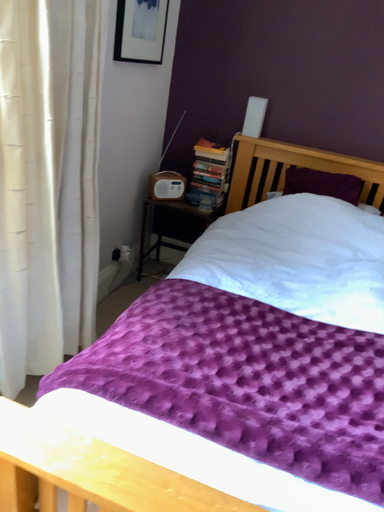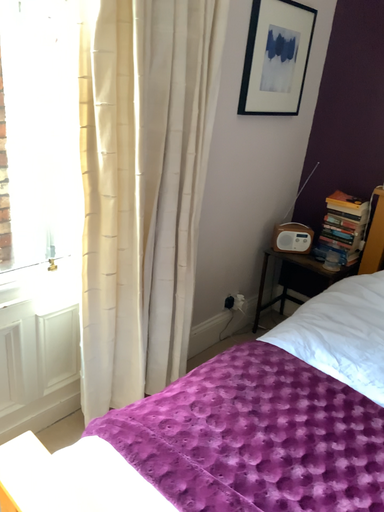
Question: How did the camera likely rotate when shooting the video?

Choices:
 (A) rotated right
 (B) rotated left

Answer: (B)